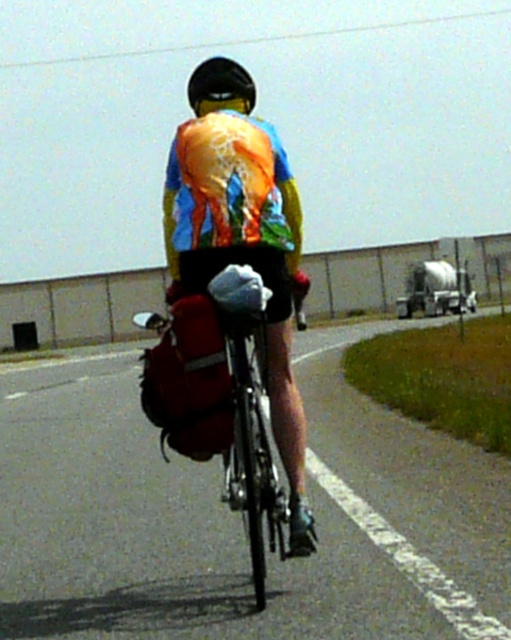
Which is more to the left, matte red backpack at center or shiny reflective safety vest at center?

matte red backpack at center is more to the left.

Does matte red backpack at center appear over shiny reflective safety vest at center?

Actually, matte red backpack at center is below shiny reflective safety vest at center.

Which is behind, point (235, 356) or point (225, 224)?

Point (225, 224)

Locate an element on the screen. The height and width of the screenshot is (640, 511). matte red backpack at center is located at coordinates (220, 397).

Is point (185, 413) farther from viewer compared to point (242, 86)?

No, (185, 413) is closer to viewer.

Who is positioned more to the left, matte red backpack at center or black matte helmet at upper center?

matte red backpack at center is more to the left.

Identify the location of matte red backpack at center. coord(220,397).

Does point (217, 502) come closer to viewer compared to point (167, 218)?

No, it is behind (167, 218).

Is matte black bicycle at center below shiny reflective safety vest at center?

Indeed, matte black bicycle at center is positioned under shiny reflective safety vest at center.

Is point (84, 417) more distant than point (230, 236)?

Yes, point (84, 417) is farther from viewer.

Where is `matte black bicycle at center`? This screenshot has width=511, height=640. matte black bicycle at center is located at coordinates (240, 516).